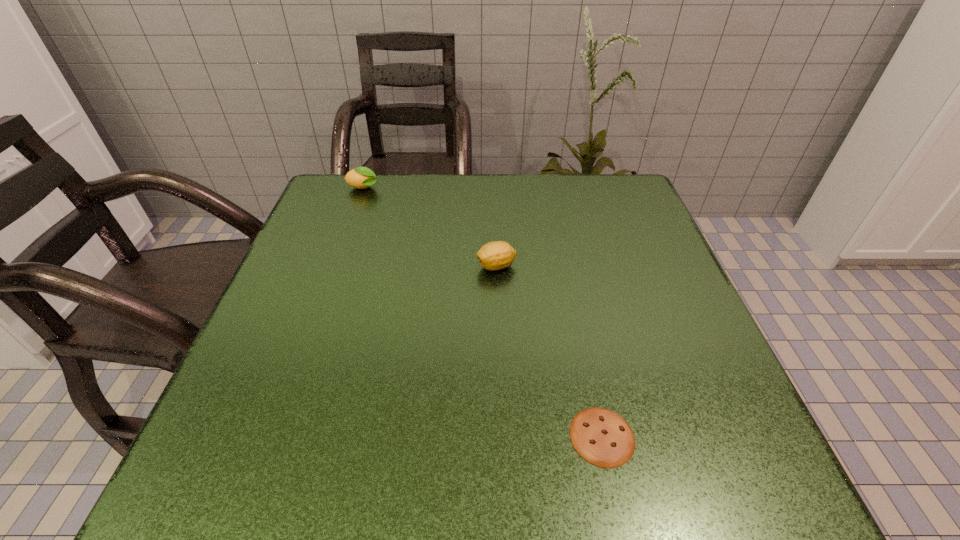
At what (x,y) coordinates should I click in order to perform the action: click on vacant space in between the rightmost object and the second object from left to right. Please return your answer as a coordinate pair (x, y). The height and width of the screenshot is (540, 960). Looking at the image, I should click on (549, 352).

Image resolution: width=960 pixels, height=540 pixels. In order to click on object that ranks as the closest to the nearer lemon in this screenshot , I will do `click(602, 437)`.

In order to click on object that is the nearest to the nearest object in this screenshot , I will do pyautogui.click(x=496, y=255).

Locate an element on the screen. This screenshot has height=540, width=960. free space in the image that satisfies the following two spatial constraints: 1. with leaves positioned above the farthest object; 2. on the back side of the rightmost object is located at coordinates coord(274,436).

The width and height of the screenshot is (960, 540). What are the coordinates of `free space that satisfies the following two spatial constraints: 1. at the stem end of the second object from right to left; 2. on the back side of the rightmost object` in the screenshot? It's located at (504, 436).

The image size is (960, 540). Identify the location of vacant space that satisfies the following two spatial constraints: 1. on the back side of the rightmost object; 2. at the stem end of the right lemon. (565, 266).

At what (x,y) coordinates should I click in order to perform the action: click on free space that satisfies the following two spatial constraints: 1. with leaves positioned above the farther lemon; 2. on the left side of the cookie. Please return your answer as a coordinate pair (x, y). Looking at the image, I should click on (274, 436).

This screenshot has width=960, height=540. I want to click on vacant space that satisfies the following two spatial constraints: 1. on the back side of the cookie; 2. at the stem end of the nearer lemon, so click(565, 266).

Where is `vacant point that satisfies the following two spatial constraints: 1. on the back side of the nearest object; 2. with leaves positioned above the left lemon`? This screenshot has width=960, height=540. vacant point that satisfies the following two spatial constraints: 1. on the back side of the nearest object; 2. with leaves positioned above the left lemon is located at coordinates (549, 188).

Locate an element on the screen. The height and width of the screenshot is (540, 960). free space that satisfies the following two spatial constraints: 1. at the stem end of the shortest object; 2. on the right side of the second object from left to right is located at coordinates (504, 436).